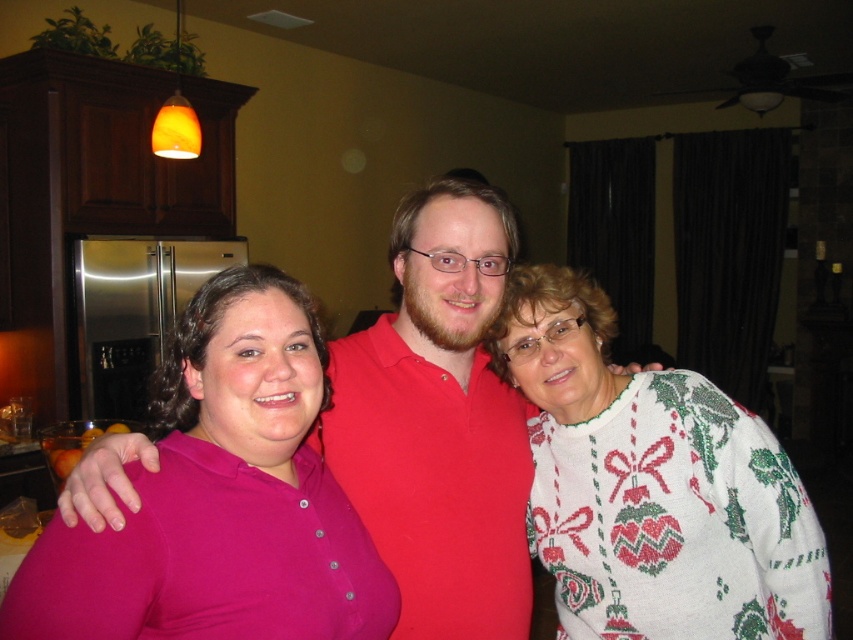
Does white knitted sweater at right have a lesser width compared to matte red shirt at center?

Yes.

Which is behind, point (709, 458) or point (357, 406)?

The point (357, 406) is more distant.

You are a GUI agent. You are given a task and a screenshot of the screen. Output one action in this format:
    pyautogui.click(x=<x>, y=<y>)
    Task: Click on the white knitted sweater at right
    The image size is (853, 640).
    Given the screenshot: What is the action you would take?
    pyautogui.click(x=653, y=484)

Is matte pink shirt at center smaller than white knitted sweater at right?

Correct, matte pink shirt at center occupies less space than white knitted sweater at right.

The width and height of the screenshot is (853, 640). Find the location of `matte pink shirt at center`. matte pink shirt at center is located at coordinates (221, 497).

Who is lower down, matte pink shirt at center or matte red shirt at center?

matte pink shirt at center

Which is in front, point (271, 577) or point (380, 547)?

Point (271, 577) is more forward.

Is point (234, 291) positioned after point (492, 426)?

No, (234, 291) is in front of (492, 426).

At what (x,y) coordinates should I click in order to perform the action: click on matte pink shirt at center. Please return your answer as a coordinate pair (x, y). Looking at the image, I should click on (221, 497).